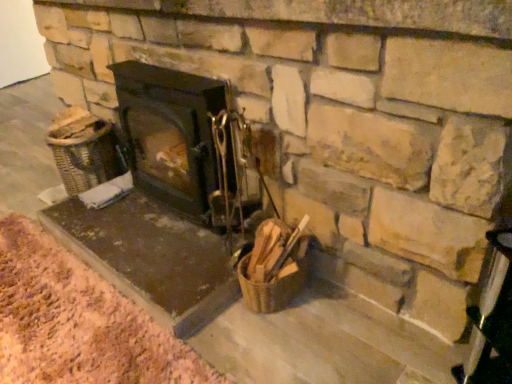
The image size is (512, 384). Describe the element at coordinates (183, 143) in the screenshot. I see `matte black wood burning stove at center` at that location.

Identify the location of matte black wood burning stove at center. (183, 143).

Locate an element on the screen. brown textured mat at lower left is located at coordinates (78, 322).

Describe the element at coordinates (78, 322) in the screenshot. I see `brown textured mat at lower left` at that location.

Where is `matte black wood burning stove at center`? This screenshot has width=512, height=384. matte black wood burning stove at center is located at coordinates (183, 143).

Considering the relative positions of brown textured mat at lower left and matte black wood burning stove at center in the image provided, is brown textured mat at lower left to the left of matte black wood burning stove at center from the viewer's perspective?

Indeed, brown textured mat at lower left is positioned on the left side of matte black wood burning stove at center.

Does brown textured mat at lower left come in front of matte black wood burning stove at center?

Yes, it is in front of matte black wood burning stove at center.

Which is more distant, (140, 329) or (188, 188)?

Point (188, 188)

From the picture: From the image's perspective, which is below, brown textured mat at lower left or matte black wood burning stove at center?

From the image's view, brown textured mat at lower left is below.

From a real-world perspective, between brown textured mat at lower left and matte black wood burning stove at center, who is vertically higher?

matte black wood burning stove at center, from a real-world perspective.

Between brown textured mat at lower left and matte black wood burning stove at center, which one has larger width?

Wider between the two is brown textured mat at lower left.

Which of these two, brown textured mat at lower left or matte black wood burning stove at center, stands taller?

matte black wood burning stove at center.

Considering the sizes of objects brown textured mat at lower left and matte black wood burning stove at center in the image provided, who is bigger, brown textured mat at lower left or matte black wood burning stove at center?

matte black wood burning stove at center is bigger.

Looking at this image, is matte black wood burning stove at center surrounded by brown textured mat at lower left?

Definitely not — matte black wood burning stove at center is not inside brown textured mat at lower left.

Can you see brown textured mat at lower left touching matte black wood burning stove at center?

brown textured mat at lower left and matte black wood burning stove at center are not in contact.

Is brown textured mat at lower left oriented away from matte black wood burning stove at center?

No, matte black wood burning stove at center is not at the back of brown textured mat at lower left.

How different are the orientations of brown textured mat at lower left and matte black wood burning stove at center in degrees?

The facing directions of brown textured mat at lower left and matte black wood burning stove at center are 2.32 degrees apart.

Looking at this image, how much distance is there between brown textured mat at lower left and matte black wood burning stove at center?

brown textured mat at lower left is 57.96 centimeters from matte black wood burning stove at center.

Find the location of a particular element. debris below the matte black wood burning stove at center (from the image's perspective) is located at coordinates (78, 322).

Can you confirm if matte black wood burning stove at center is positioned to the right of brown textured mat at lower left?

Yes.

Considering the positions of objects matte black wood burning stove at center and brown textured mat at lower left in the image provided, who is behind, matte black wood burning stove at center or brown textured mat at lower left?

Positioned behind is matte black wood burning stove at center.

Between point (128, 114) and point (106, 325), which one is positioned in front?

Point (106, 325)

From the image's perspective, is matte black wood burning stove at center on brown textured mat at lower left?

Yes, from the image's perspective, matte black wood burning stove at center is on top of brown textured mat at lower left.

From a real-world perspective, which object rests below the other?

brown textured mat at lower left is physically lower.

Between matte black wood burning stove at center and brown textured mat at lower left, which one has smaller width?

With smaller width is matte black wood burning stove at center.

Consider the image. Is matte black wood burning stove at center taller or shorter than brown textured mat at lower left?

In the image, matte black wood burning stove at center appears to be taller than brown textured mat at lower left.

Considering the sizes of objects matte black wood burning stove at center and brown textured mat at lower left in the image provided, who is bigger, matte black wood burning stove at center or brown textured mat at lower left?

With larger size is matte black wood burning stove at center.

Is matte black wood burning stove at center situated inside brown textured mat at lower left or outside?

matte black wood burning stove at center is spatially situated outside brown textured mat at lower left.

Does matte black wood burning stove at center touch brown textured mat at lower left?

matte black wood burning stove at center and brown textured mat at lower left are clearly separated.

Is matte black wood burning stove at center positioned with its back to brown textured mat at lower left?

matte black wood burning stove at center is not turned away from brown textured mat at lower left.

What's the angular difference between matte black wood burning stove at center and brown textured mat at lower left's facing directions?

2.32 degrees.

There is a brown textured mat at lower left. Where is `wood burning stove above it (from a real-world perspective)`? wood burning stove above it (from a real-world perspective) is located at coordinates (183, 143).

Identify the location of wood burning stove that is behind the brown textured mat at lower left. pyautogui.click(x=183, y=143).

This screenshot has width=512, height=384. I want to click on debris in front of the matte black wood burning stove at center, so click(78, 322).